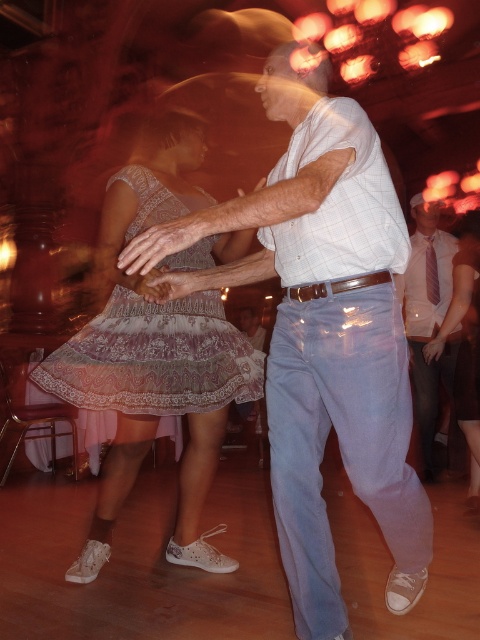
Question: Which object is the closest to the pink striped tie at center?

Choices:
 (A) white lace dress at center
 (B) white checkered shirt at center

Answer: (A)

Question: Which of the following is the farthest from the observer?

Choices:
 (A) white lace dress at center
 (B) pink striped tie at center
 (C) lace fabric skirt at center

Answer: (B)

Question: Which of the following is the closest to the observer?

Choices:
 (A) lace fabric skirt at center
 (B) white lace dress at center
 (C) pink striped tie at center
 (D) white checkered shirt at center

Answer: (D)

Question: Is white checkered shirt at center closer to the viewer compared to pink striped tie at center?

Choices:
 (A) no
 (B) yes

Answer: (B)

Question: Is the position of pink striped tie at center more distant than that of lace fabric skirt at center?

Choices:
 (A) yes
 (B) no

Answer: (A)

Question: Observing the image, what is the correct spatial positioning of white checkered shirt at center in reference to white lace dress at center?

Choices:
 (A) below
 (B) above

Answer: (A)